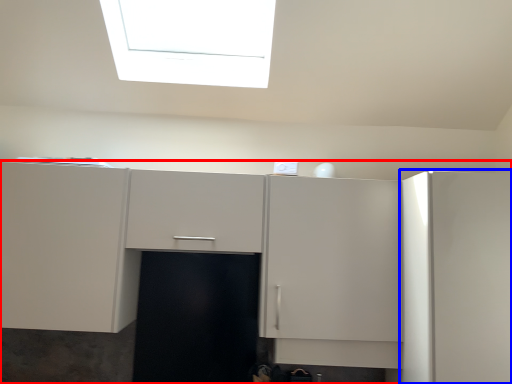
Question: Among these objects, which one is nearest to the camera, cabinetry (highlighted by a red box) or cabinetry (highlighted by a blue box)?

Choices:
 (A) cabinetry
 (B) cabinetry

Answer: (B)